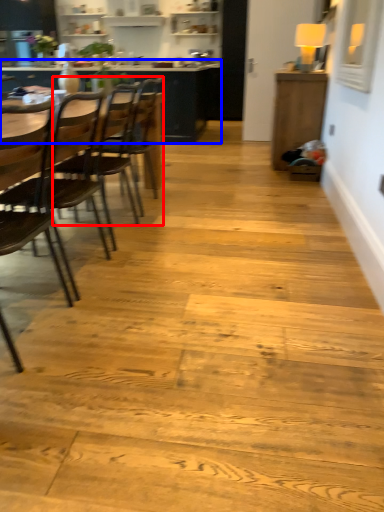
Question: Which of the following is the farthest to the observer, chair (highlighted by a red box) or table (highlighted by a blue box)?

Choices:
 (A) chair
 (B) table

Answer: (B)